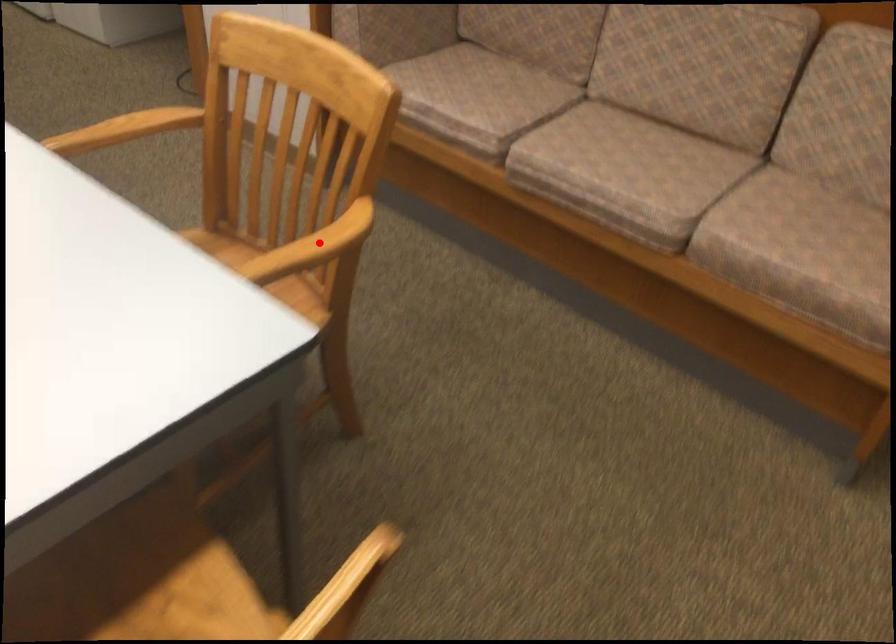
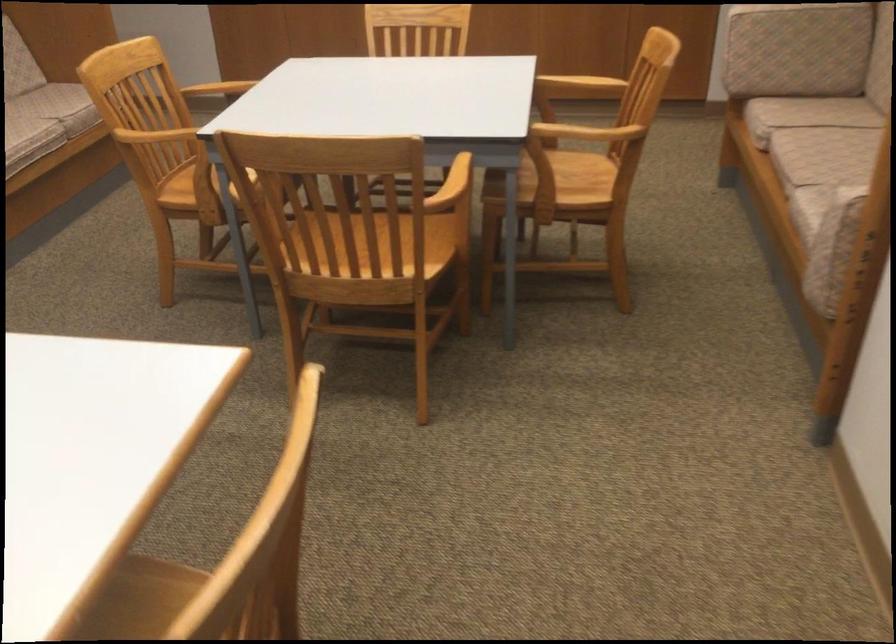
Question: I am providing you with two images of the same scene from different viewpoints. A red point is marked on the first image. At the location where the point appears in image 1, is it still visible in image 2?

Choices:
 (A) Yes
 (B) No

Answer: (A)